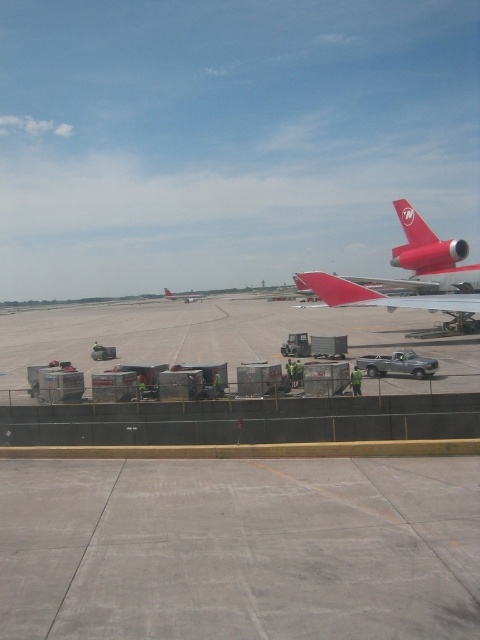
Image resolution: width=480 pixels, height=640 pixels. Describe the element at coordinates (424, 260) in the screenshot. I see `matte red airplane at upper right` at that location.

Does matte red airplane at upper right have a smaller size compared to red matte airplane at center?

Actually, matte red airplane at upper right might be larger than red matte airplane at center.

Is point (460, 291) more distant than point (325, 273)?

That is True.

At what (x,y) coordinates should I click in order to perform the action: click on matte red airplane at upper right. Please return your answer as a coordinate pair (x, y). Looking at the image, I should click on (424, 260).

Between point (422, 244) and point (187, 300), which one is positioned in front?

Positioned in front is point (422, 244).

The image size is (480, 640). Describe the element at coordinates (424, 260) in the screenshot. I see `matte red airplane at upper right` at that location.

Where is `matte red airplane at upper right`? The height and width of the screenshot is (640, 480). matte red airplane at upper right is located at coordinates (424, 260).

Between red matte airplane at center and metallic silver airplane at center, which one has more height?

Standing taller between the two is metallic silver airplane at center.

Who is higher up, red matte airplane at center or metallic silver airplane at center?

metallic silver airplane at center is above.

From the picture: Measure the distance between red matte airplane at center and camera.

A distance of 24.73 meters exists between red matte airplane at center and camera.

Locate an element on the screen. red matte airplane at center is located at coordinates 383,296.